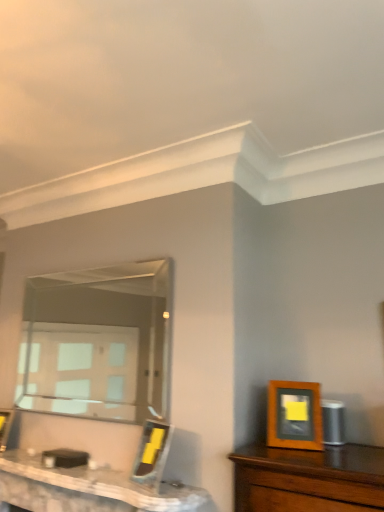
Question: Would you say wooden picture frame at center, which is the third picture frame in front-to-back order, is inside or outside wooden picture frame at right, which is the first picture frame in right-to-left order?

Choices:
 (A) outside
 (B) inside

Answer: (A)

Question: From the image's perspective, is wooden picture frame at center, the 3th picture frame when ordered from right to left, above or below wooden picture frame at right, which is the 3th picture frame from back to front?

Choices:
 (A) above
 (B) below

Answer: (B)

Question: Which is farther from the wooden picture frame at center, which is the first picture frame in left-to-right order?

Choices:
 (A) clear glass mirror at center
 (B) white marble table at lower left
 (C) wooden picture frame at center, the 2th picture frame in the back-to-front sequence
 (D) wooden picture frame at right, which ranks as the 3th picture frame in left-to-right order

Answer: (A)

Question: Estimate the real-world distances between objects in this image. Which object is closer to the wooden picture frame at center, arranged as the first picture frame when viewed from the back?

Choices:
 (A) white marble table at lower left
 (B) wooden picture frame at right, which is the 3th picture frame from back to front
 (C) wooden picture frame at center, placed as the second picture frame when sorted from right to left
 (D) clear glass mirror at center

Answer: (A)